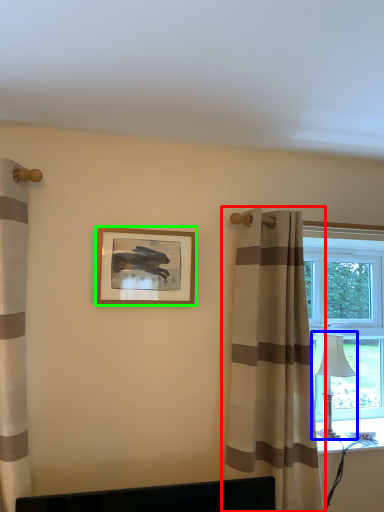
Question: Which object is the closest to the curtain (highlighted by a red box)? Choose among these: table lamp (highlighted by a blue box) or picture frame (highlighted by a green box).

Choices:
 (A) table lamp
 (B) picture frame

Answer: (A)